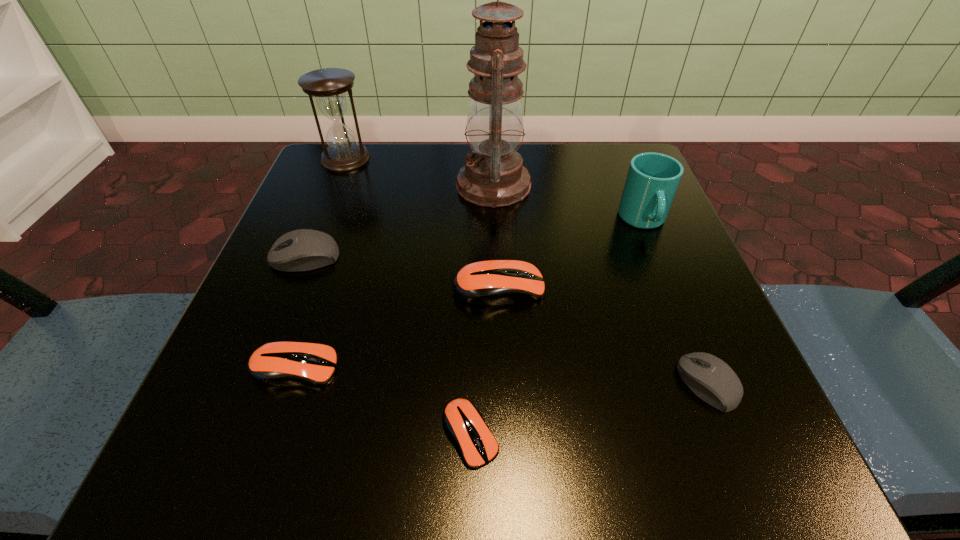
This screenshot has height=540, width=960. Find the location of `oil lamp that is at the far edge`. oil lamp that is at the far edge is located at coordinates (493, 176).

This screenshot has height=540, width=960. Find the location of `hourglass positioned at the far edge`. hourglass positioned at the far edge is located at coordinates (328, 86).

Image resolution: width=960 pixels, height=540 pixels. Find the location of `cup at the far edge`. cup at the far edge is located at coordinates 653,178.

This screenshot has height=540, width=960. Find the location of `hourglass that is positioned at the left edge`. hourglass that is positioned at the left edge is located at coordinates (328, 86).

You are a GUI agent. You are given a task and a screenshot of the screen. Output one action in this format:
    pyautogui.click(x=<x>, y=<y>)
    Task: Click on the cup at the right edge
    This screenshot has height=540, width=960.
    Given the screenshot: What is the action you would take?
    coord(653,178)

I want to click on computer equipment at the right edge, so click(717, 384).

I want to click on object that is at the far left corner, so click(x=328, y=86).

I want to click on object at the far right corner, so click(x=653, y=178).

Where is `object at the near right corner`? object at the near right corner is located at coordinates tap(717, 384).

I want to click on free point at the far edge, so click(x=556, y=147).